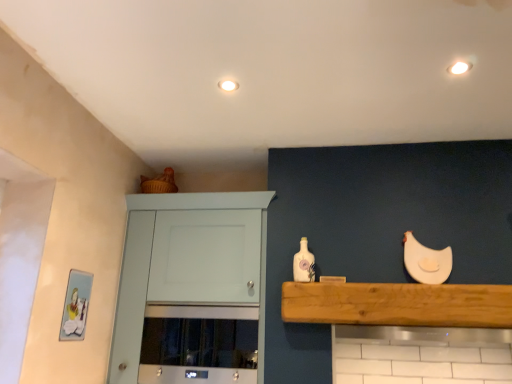
The image size is (512, 384). I want to click on blank space situated above wooden at upper center (from a real-world perspective), so click(x=390, y=283).